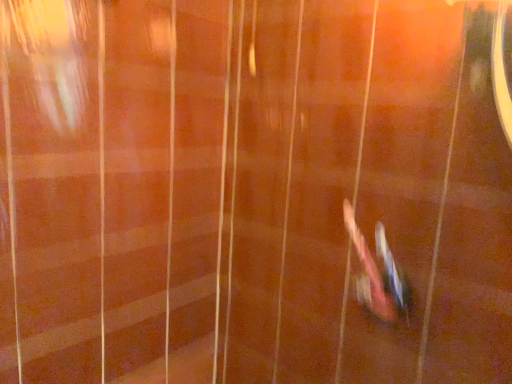
What do you see at coordinates (378, 273) in the screenshot? I see `metallic pink phone at lower right` at bounding box center [378, 273].

The image size is (512, 384). Identify the location of metallic pink phone at lower right. (378, 273).

At what (x,y) coordinates should I click in order to perform the action: click on metallic pink phone at lower right. Please return your answer as a coordinate pair (x, y). This screenshot has width=512, height=384. Looking at the image, I should click on (378, 273).